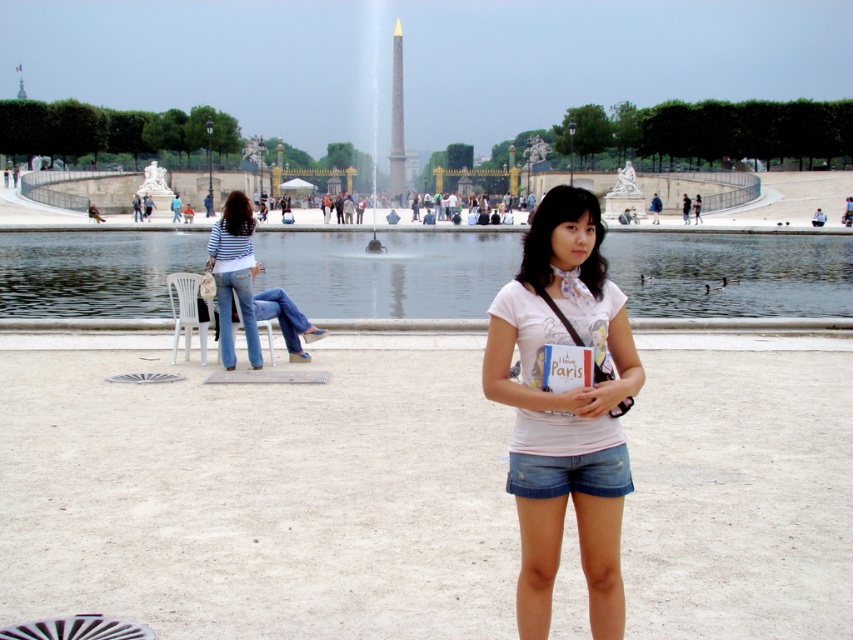
You are standing in the park and want to walk towards the point that is closer to the camera between the two points labeled as point (x=177, y=259) and point (x=611, y=388). Which point should you walk towards?

You should walk towards point (x=177, y=259) because it is closer to the camera than point (x=611, y=388).

You are standing in the public square and want to place a small bench between the clear water at center and the denim shorts at lower center. The bench is 5 feet long. Will there be enough space between them to place the bench?

The clear water at center and denim shorts at lower center are 89.85 feet apart from each other. Since the bench is only 5 feet long, there is more than enough space to place it between them.